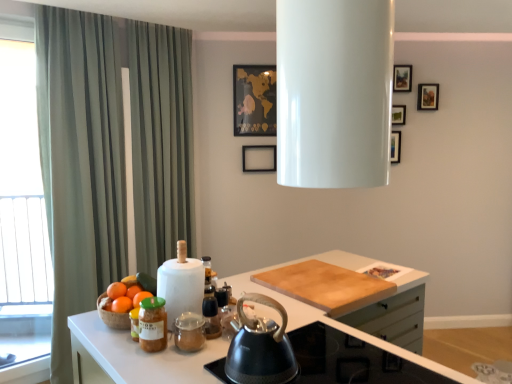
Image resolution: width=512 pixels, height=384 pixels. Identify the location of free spot in front of orange matte at lower left, the 2th orange when ordered from left to right. (124, 347).